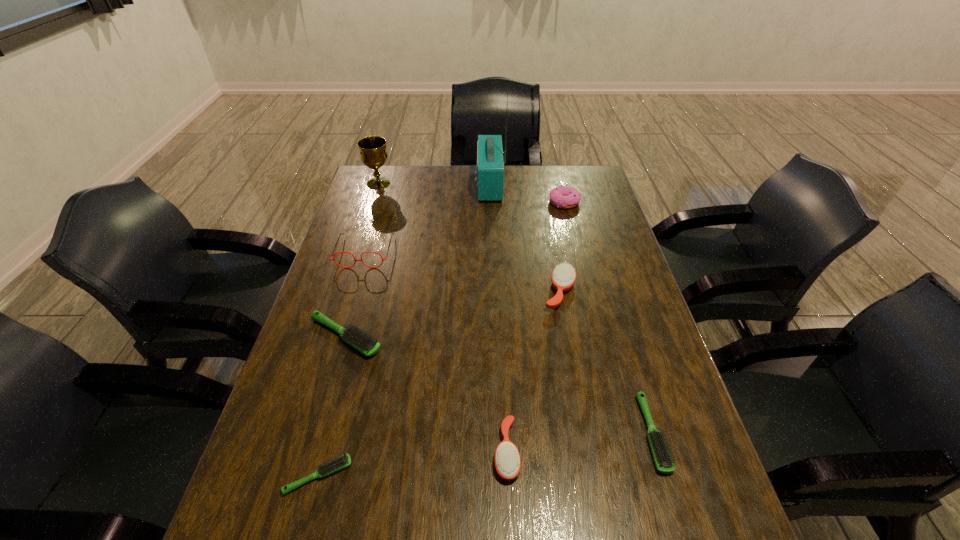
Find the location of `vacant region between the biggest light hairbrush and the light radio receiver`. vacant region between the biggest light hairbrush and the light radio receiver is located at coordinates (418, 260).

Image resolution: width=960 pixels, height=540 pixels. I want to click on the fifth closest object to the third hairbrush from left to right, so click(x=333, y=259).

Where is `the closest object to the tallest object`? the closest object to the tallest object is located at coordinates (565, 197).

Locate an element on the screen. The width and height of the screenshot is (960, 540). hairbrush that is the second nearest to the biggest light hairbrush is located at coordinates pos(507,458).

This screenshot has width=960, height=540. Find the location of `hairbrush that stands as the second closest to the shortest hairbrush`. hairbrush that stands as the second closest to the shortest hairbrush is located at coordinates (507, 458).

Identify which light hairbrush is the second closest to the nearer orange hairbrush. Please provide its 2D coordinates. Your answer should be formatted as a tuple, i.e. [(x, y)], where the tuple contains the x and y coordinates of a point satisfying the conditions above.

[(344, 461)]

Identify which light hairbrush is the third nearest to the tallest object. Please provide its 2D coordinates. Your answer should be formatted as a tuple, i.e. [(x, y)], where the tuple contains the x and y coordinates of a point satisfying the conditions above.

[(344, 461)]

Identify the location of vacant space that satisfies the following two spatial constraints: 1. on the front-facing side of the fourth farthest object; 2. on the right side of the farther orange hairbrush. The width and height of the screenshot is (960, 540). coord(353,292).

Where is `vacant position in the image that satisfies the following two spatial constraints: 1. on the front panel of the light radio receiver; 2. on the front-facing side of the seventh shortest object`? Image resolution: width=960 pixels, height=540 pixels. vacant position in the image that satisfies the following two spatial constraints: 1. on the front panel of the light radio receiver; 2. on the front-facing side of the seventh shortest object is located at coordinates (492, 252).

Identify the location of free space that satisfies the following two spatial constraints: 1. on the front-facing side of the spectacles; 2. on the right side of the tallest hairbrush. This screenshot has width=960, height=540. (353, 292).